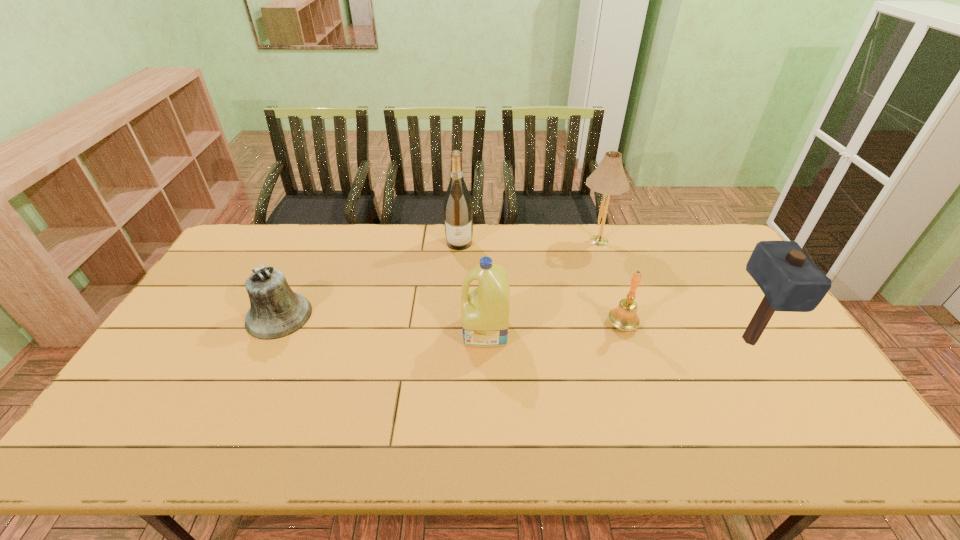
Where is `lampshade`? The image size is (960, 540). lampshade is located at coordinates (608, 178).

This screenshot has width=960, height=540. I want to click on wine bottle, so click(x=458, y=213).

What are the coordinates of `mallet` in the screenshot? It's located at (789, 280).

You are a GUI agent. You are given a task and a screenshot of the screen. Output one action in this format:
    pyautogui.click(x=<x>, y=<y>)
    Task: Click on the fourth tallest object
    
    Given the screenshot: What is the action you would take?
    pyautogui.click(x=485, y=310)

Image resolution: width=960 pixels, height=540 pixels. I want to click on the right bell, so pyautogui.click(x=624, y=317).

Where is `the leftmost object`? Image resolution: width=960 pixels, height=540 pixels. the leftmost object is located at coordinates (276, 311).

At what (x,y) coordinates should I click in order to perform the action: click on vacant region located on the left of the lampshade. Please return your answer as a coordinate pair (x, y). Image resolution: width=960 pixels, height=540 pixels. Looking at the image, I should click on (523, 241).

Identify the location of vacant position located 0.350m on the label of the wine bottle. This screenshot has height=540, width=960. (455, 324).

The image size is (960, 540). Identify the location of vacant region located 0.200m on the front of the mallet. (804, 431).

The height and width of the screenshot is (540, 960). In order to click on vacant space positioned 0.070m on the label of the detergent in this screenshot , I will do `click(438, 332)`.